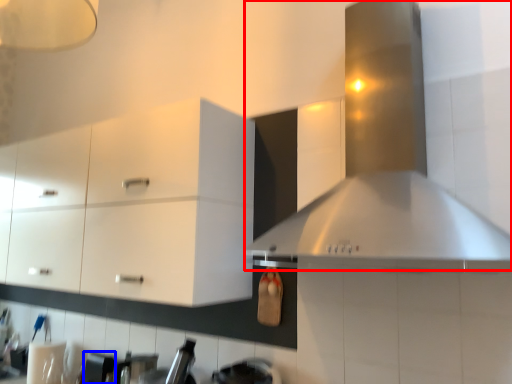
Question: Which of the following is the closest to the observer, vent (highlighted by a red box) or appliance (highlighted by a blue box)?

Choices:
 (A) vent
 (B) appliance

Answer: (A)